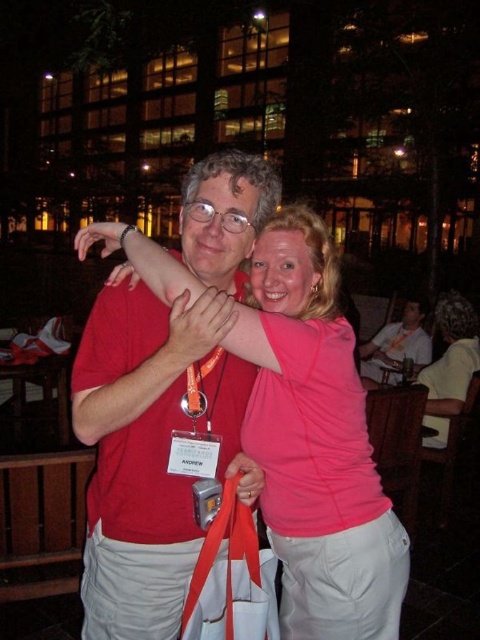
Which is in front, point (231, 163) or point (407, 305)?

Point (231, 163) is in front.

At what (x,y) coordinates should I click in order to perform the action: click on matte red shirt at center. Please return your answer as a coordinate pair (x, y). The width and height of the screenshot is (480, 640). Looking at the image, I should click on [x=157, y=403].

Is point (166, 554) closer to viewer compared to point (191, 387)?

Yes, it is.

Is matte red shirt at center above orange fabric lanyard at center?

No, matte red shirt at center is not above orange fabric lanyard at center.

Does point (230, 397) lie in front of point (199, 381)?

No, it is not.

You are a GUI agent. You are given a task and a screenshot of the screen. Output one action in this format:
    pyautogui.click(x=<x>, y=<y>)
    Task: Click on the matte red shirt at center
    This screenshot has width=480, height=640.
    Given the screenshot: What is the action you would take?
    pyautogui.click(x=157, y=403)

Does light brown wooden chair at lower right appear on the right side of orange fabric lanyard at center?

Yes, light brown wooden chair at lower right is to the right of orange fabric lanyard at center.

Is light brown wooden chair at lower right positioned before orange fabric lanyard at center?

No, it is not.

Does point (370, 348) come closer to viewer compared to point (194, 374)?

No, it is not.

Where is `light brown wooden chair at lower right`? The image size is (480, 640). light brown wooden chair at lower right is located at coordinates (396, 348).